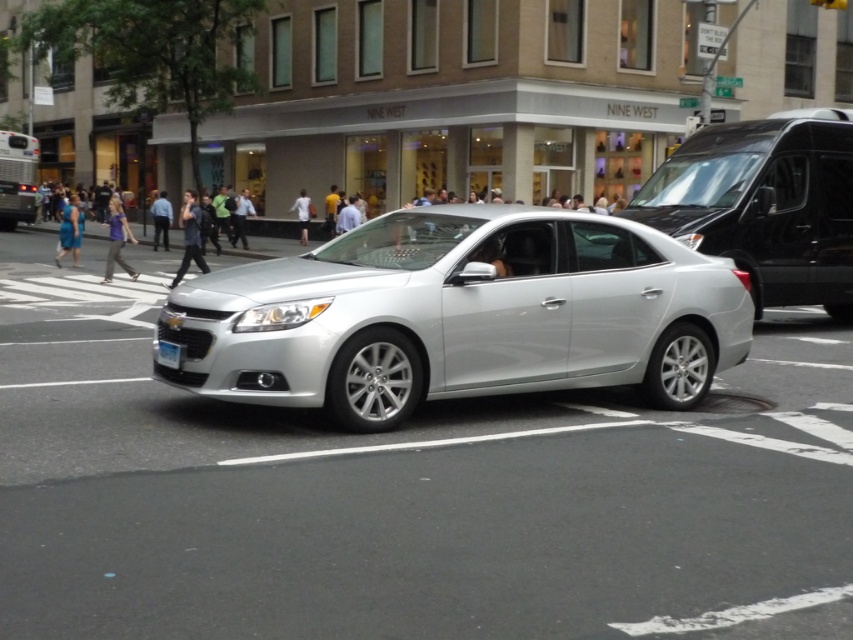
Can you confirm if shiny black van at center right is positioned to the right of white plastic license plate at center?

Correct, you'll find shiny black van at center right to the right of white plastic license plate at center.

Is point (798, 118) farther from viewer compared to point (173, 358)?

Yes, it is behind point (173, 358).

Does point (723, 216) come in front of point (172, 349)?

No, it is behind (172, 349).

Find the location of a particular element. The height and width of the screenshot is (640, 853). shiny black van at center right is located at coordinates (763, 205).

Is point (553, 266) closer to viewer compared to point (178, 358)?

No, (553, 266) is behind (178, 358).

Is silver metallic sedan at center wider than white plastic license plate at center?

Yes, silver metallic sedan at center is wider than white plastic license plate at center.

Who is more forward, (x=204, y=372) or (x=167, y=365)?

Point (x=204, y=372) is in front.

This screenshot has height=640, width=853. I want to click on silver metallic sedan at center, so click(x=460, y=316).

Does point (584, 337) come closer to viewer compared to point (700, 198)?

Yes, it is in front of point (700, 198).

Who is more distant from viewer, (175, 314) or (834, 193)?

The point (834, 193) is behind.

Identify the location of silver metallic sedan at center. This screenshot has height=640, width=853. (460, 316).